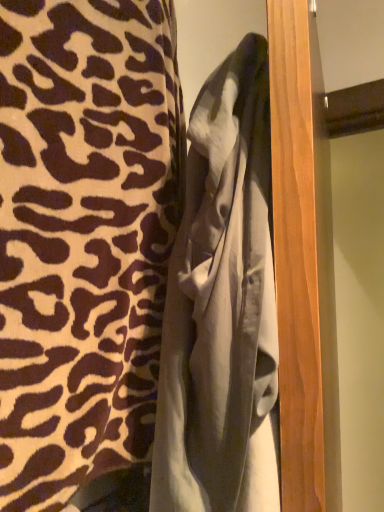
Question: From the image's perspective, is leopard print fabric at center above or below gray cotton bathrobe at center?

Choices:
 (A) below
 (B) above

Answer: (B)

Question: Relative to gray cotton bathrobe at center, is leopard print fabric at center in front or behind?

Choices:
 (A) behind
 (B) front

Answer: (B)

Question: Considering the positions of leopard print fabric at center and gray cotton bathrobe at center in the image, is leopard print fabric at center bigger or smaller than gray cotton bathrobe at center?

Choices:
 (A) small
 (B) big

Answer: (B)

Question: From the image's perspective, is gray cotton bathrobe at center located above or below leopard print fabric at center?

Choices:
 (A) above
 (B) below

Answer: (B)

Question: From a real-world perspective, is gray cotton bathrobe at center positioned above or below leopard print fabric at center?

Choices:
 (A) below
 (B) above

Answer: (A)

Question: Is gray cotton bathrobe at center wider or thinner than leopard print fabric at center?

Choices:
 (A) wide
 (B) thin

Answer: (B)

Question: Would you say gray cotton bathrobe at center is to the left or to the right of leopard print fabric at center in the picture?

Choices:
 (A) right
 (B) left

Answer: (A)